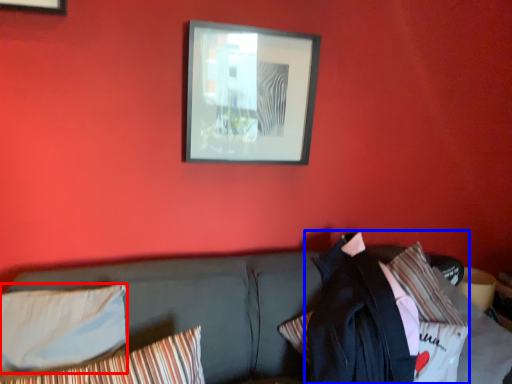
Question: Among these objects, which one is nearest to the camera, pillow (highlighted by a red box) or jacket (highlighted by a blue box)?

Choices:
 (A) pillow
 (B) jacket

Answer: (A)